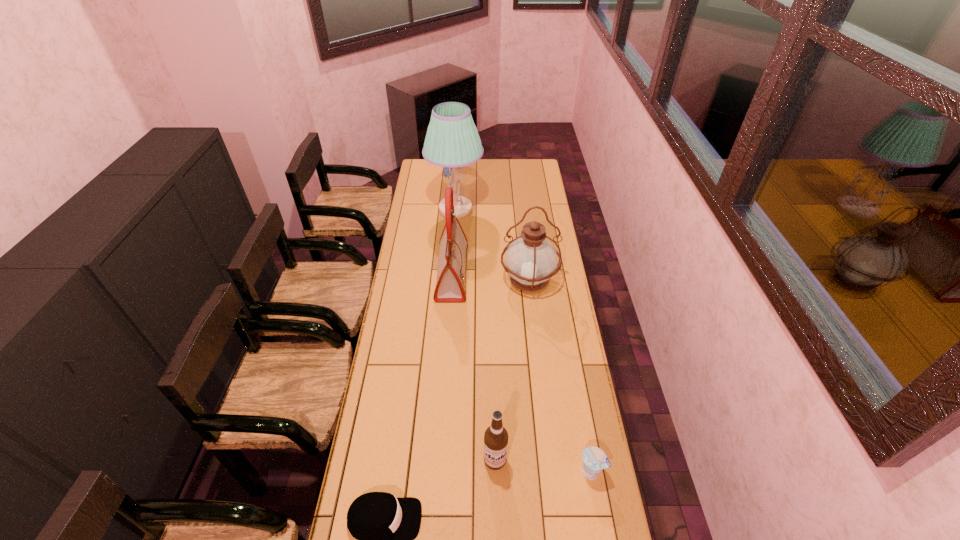
Locate an element on the screen. free space that is in between the oil lamp and the yogurt is located at coordinates (560, 376).

Where is `free space between the fourth tallest object and the handbag`? free space between the fourth tallest object and the handbag is located at coordinates tap(473, 366).

This screenshot has width=960, height=540. What are the coordinates of `unoccupied position between the oil lamp and the third shortest object` in the screenshot? It's located at (512, 370).

Locate an element on the screen. vacant space that is in between the fourth tallest object and the yogurt is located at coordinates (543, 466).

Find the location of a particular element. free point between the handbag and the alcohol is located at coordinates (473, 366).

Choose which object is the second nearest neighbor to the lamp. Please provide its 2D coordinates. Your answer should be formatted as a tuple, i.e. [(x, y)], where the tuple contains the x and y coordinates of a point satisfying the conditions above.

[(530, 259)]

Identify which object is the closest to the alcohol. Please provide its 2D coordinates. Your answer should be formatted as a tuple, i.e. [(x, y)], where the tuple contains the x and y coordinates of a point satisfying the conditions above.

[(385, 526)]

Locate an element on the screen. free location that satisfies the following two spatial constraints: 1. on the label of the alcohol; 2. on the right side of the yogurt is located at coordinates (495, 471).